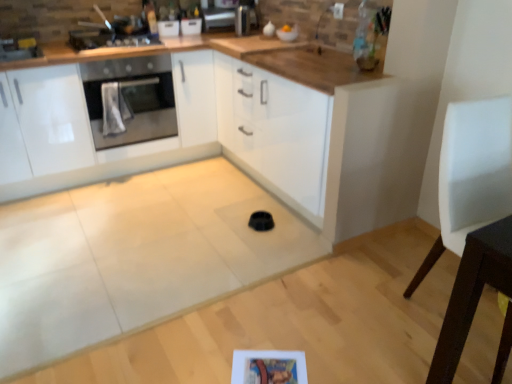
I want to click on free space to the left of satin silver toaster at upper center, so click(224, 36).